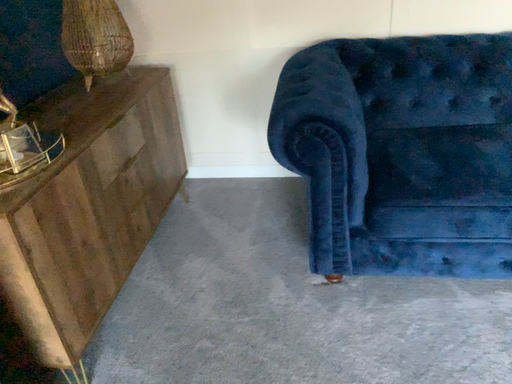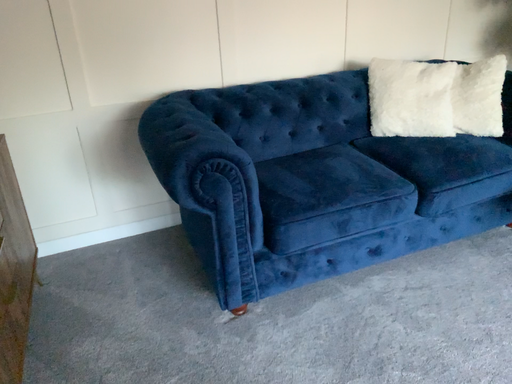
Question: How did the camera likely rotate when shooting the video?

Choices:
 (A) rotated right
 (B) rotated left

Answer: (A)